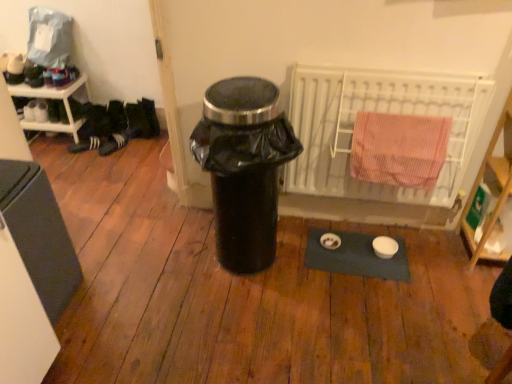
Locate an element on the screen. Image resolution: width=512 pixels, height=384 pixels. free spot above white textured shoe at left, which appears as the 2th shoe when viewed from the left (from a real-world perspective) is located at coordinates (109, 129).